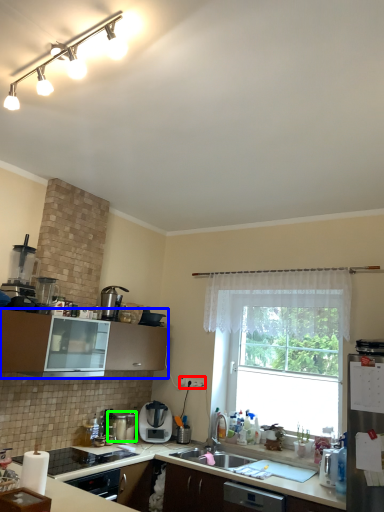
Question: Which object is the closest to the electric outlet (highlighted by a red box)? Choose among these: cabinetry (highlighted by a blue box) or appliance (highlighted by a green box).

Choices:
 (A) cabinetry
 (B) appliance

Answer: (B)